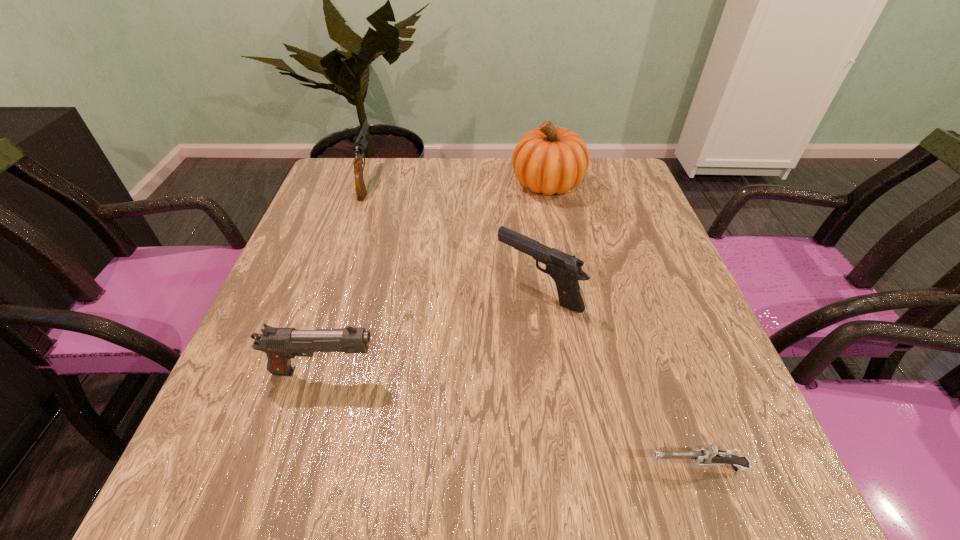
Locate an element on the screen. The height and width of the screenshot is (540, 960). blank area located at the muzzle of the second farthest gun is located at coordinates [x=417, y=291].

This screenshot has height=540, width=960. What are the coordinates of `free point located 0.150m in the direction the third farthest gun is aimed` in the screenshot? It's located at click(x=462, y=372).

You are a GUI agent. You are given a task and a screenshot of the screen. Output one action in this format:
    pyautogui.click(x=<x>, y=<y>)
    Task: Click on the free point located 0.160m aimed along the barrel of the shortest gun
    The height and width of the screenshot is (540, 960).
    Given the screenshot: What is the action you would take?
    pyautogui.click(x=541, y=467)

Locate an element on the screen. The image size is (960, 540). blank space located 0.110m aimed along the barrel of the shortest gun is located at coordinates (575, 467).

In order to click on free space located 0.290m aimed along the barrel of the shortest gun in this screenshot , I will do `click(456, 467)`.

Identify the location of pumpkin situated at the far edge. (549, 160).

You are a GUI agent. You are given a task and a screenshot of the screen. Output one action in this format:
    pyautogui.click(x=<x>, y=<y>)
    Task: Click on the gun that is positioned at the far edge
    
    Given the screenshot: What is the action you would take?
    pyautogui.click(x=360, y=145)

Image resolution: width=960 pixels, height=540 pixels. Identify the location of object that is at the near edge. (710, 455).

This screenshot has width=960, height=540. Find the location of `pumpkin that is positioned at the right edge`. pumpkin that is positioned at the right edge is located at coordinates (549, 160).

You are a GUI agent. You are given a task and a screenshot of the screen. Output one action in this format:
    pyautogui.click(x=<x>, y=<y>)
    Task: Click on the gun at the right edge
    This screenshot has height=540, width=960.
    Given the screenshot: What is the action you would take?
    pyautogui.click(x=710, y=455)